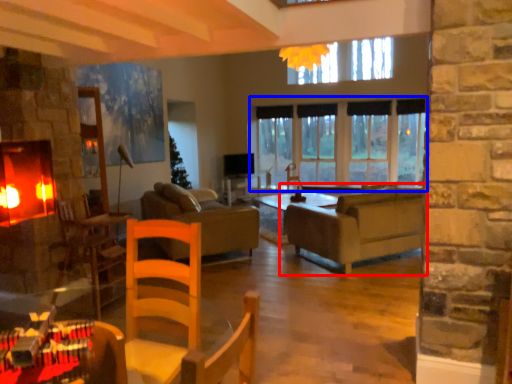
Question: Which of the following is the farthest to the observer, studio couch (highlighted by a red box) or window (highlighted by a blue box)?

Choices:
 (A) studio couch
 (B) window

Answer: (B)